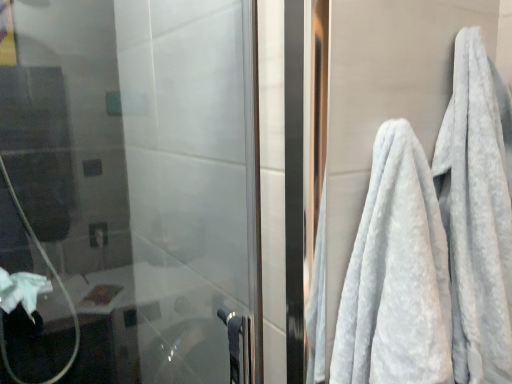
You are a GUI agent. You are given a task and a screenshot of the screen. Output one action in this format:
    pyautogui.click(x=<x>, y=<y>)
    Task: Click on the white fluffy towels at right
    
    Given the screenshot: What is the action you would take?
    pyautogui.click(x=384, y=100)

The width and height of the screenshot is (512, 384). Describe the element at coordinates (384, 100) in the screenshot. I see `white fluffy towels at right` at that location.

This screenshot has height=384, width=512. I want to click on white fluffy towels at right, so click(384, 100).